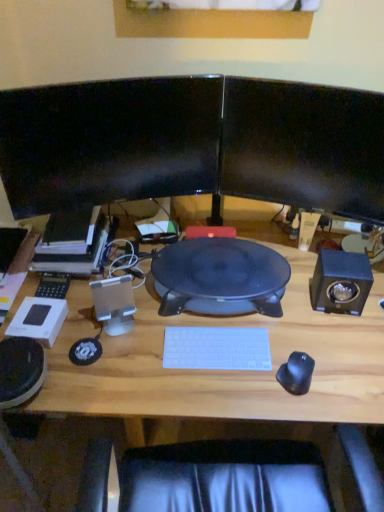
The height and width of the screenshot is (512, 384). I want to click on vacant space positioned to the left of black rubberized mouse at right, so click(x=237, y=388).